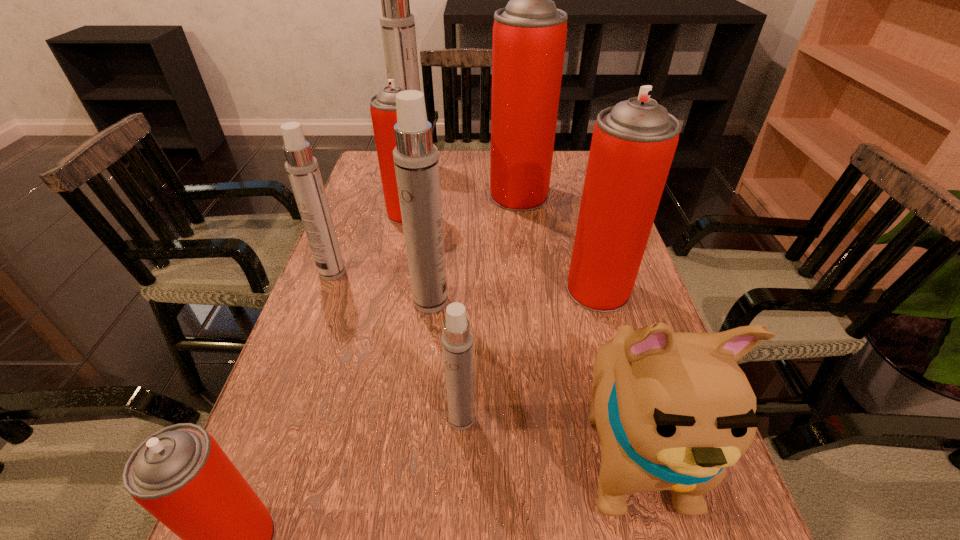
This screenshot has width=960, height=540. Identify the location of the third closest red aerosol can relative to the second nearest red aerosol can. (179, 474).

Select which red aerosol can is the closest to the third smallest white aerosol can. Please provide its 2D coordinates. Your answer should be formatted as a tuple, i.e. [(x, y)], where the tuple contains the x and y coordinates of a point satisfying the conditions above.

[(383, 110)]

Locate which white aerosol can ranks in proximity to the third white aerosol can from left to right. Please provide its 2D coordinates. Your answer should be formatted as a tuple, i.e. [(x, y)], where the tuple contains the x and y coordinates of a point satisfying the conditions above.

[(302, 168)]

Locate which white aerosol can ranks third in proximity to the puppy. Please provide its 2D coordinates. Your answer should be formatted as a tuple, i.e. [(x, y)], where the tuple contains the x and y coordinates of a point satisfying the conditions above.

[(302, 168)]

Where is `vacant space that satisfies the following two spatial constraints: 1. on the front side of the sixth aerosol can from left to right; 2. on the left side of the second farthest white aerosol can`? vacant space that satisfies the following two spatial constraints: 1. on the front side of the sixth aerosol can from left to right; 2. on the left side of the second farthest white aerosol can is located at coordinates (278, 418).

Where is `free space that satisfies the following two spatial constraints: 1. on the front side of the farthest white aerosol can; 2. on the left side of the second nearest red aerosol can`? Image resolution: width=960 pixels, height=540 pixels. free space that satisfies the following two spatial constraints: 1. on the front side of the farthest white aerosol can; 2. on the left side of the second nearest red aerosol can is located at coordinates (384, 290).